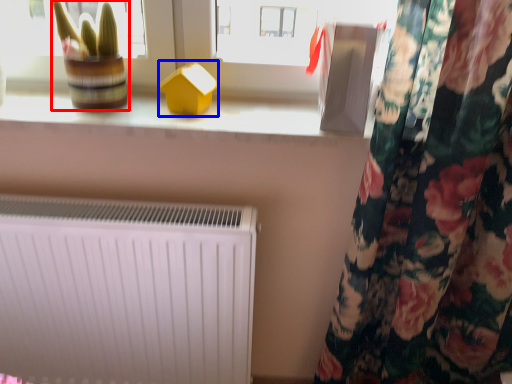
Question: Which object is closer to the camera taking this photo, plant (highlighted by a red box) or toy (highlighted by a blue box)?

Choices:
 (A) plant
 (B) toy

Answer: (A)